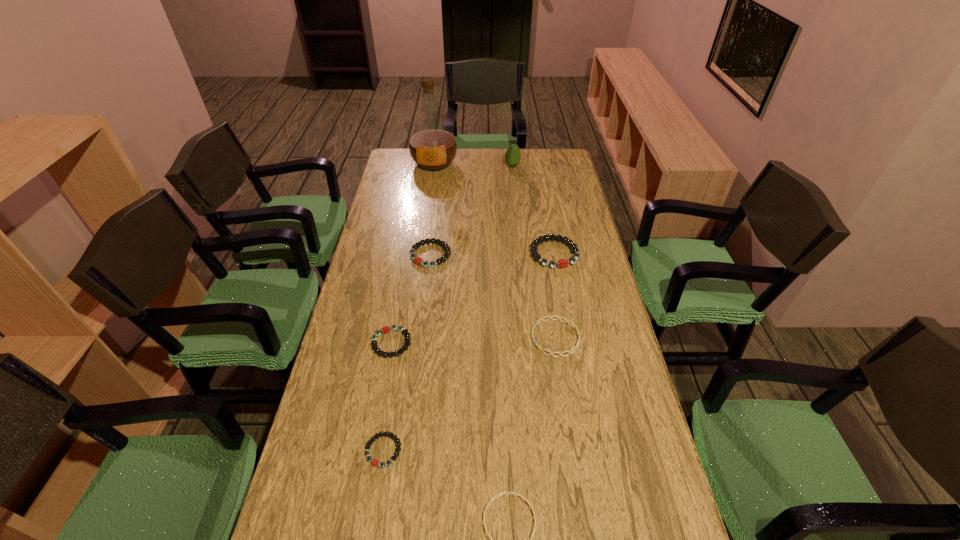
Find the location of a particular element. Image resolution: width=960 pixels, height=540 pixels. the third biggest black bracelet is located at coordinates (386, 329).

You are a GUI agent. You are given a task and a screenshot of the screen. Output one action in this format:
    pyautogui.click(x=<x>, y=<y>)
    Task: Click on the seventh farthest object
    This screenshot has width=960, height=540.
    Given the screenshot: What is the action you would take?
    pyautogui.click(x=375, y=462)

You are a GUI agent. You are given a task and a screenshot of the screen. Output one action in this format:
    pyautogui.click(x=<x>, y=<y>)
    Task: Click on the smallest black bracelet
    The width and height of the screenshot is (960, 540).
    Given the screenshot: What is the action you would take?
    pyautogui.click(x=375, y=462)

The width and height of the screenshot is (960, 540). Find the location of `blank area located 0.200m on the front label of the tallest object`. blank area located 0.200m on the front label of the tallest object is located at coordinates (429, 201).

Find the location of a particular element. free region located on the front of the seventh shortest object is located at coordinates (514, 178).

Find the location of `vacant space situated 0.340m on the back of the rightmost black bracelet`. vacant space situated 0.340m on the back of the rightmost black bracelet is located at coordinates (542, 190).

Where is `free space located 0.330m on the right of the second tallest bracelet`? The height and width of the screenshot is (540, 960). free space located 0.330m on the right of the second tallest bracelet is located at coordinates (541, 255).

At what (x,y) coordinates should I click in order to perform the action: click on free spot located 0.180m on the surface of the farther blue bracelet showing star-shaped elements. Please return your answer as a coordinate pair (x, y). This screenshot has height=540, width=960. Looking at the image, I should click on (471, 338).

This screenshot has height=540, width=960. Find the location of `free location located on the surface of the farther blue bracelet showing star-shaped elements`. free location located on the surface of the farther blue bracelet showing star-shaped elements is located at coordinates (485, 338).

Locate an element on the screen. The image size is (960, 540). blank area located on the surface of the farther blue bracelet showing star-shaped elements is located at coordinates (492, 338).